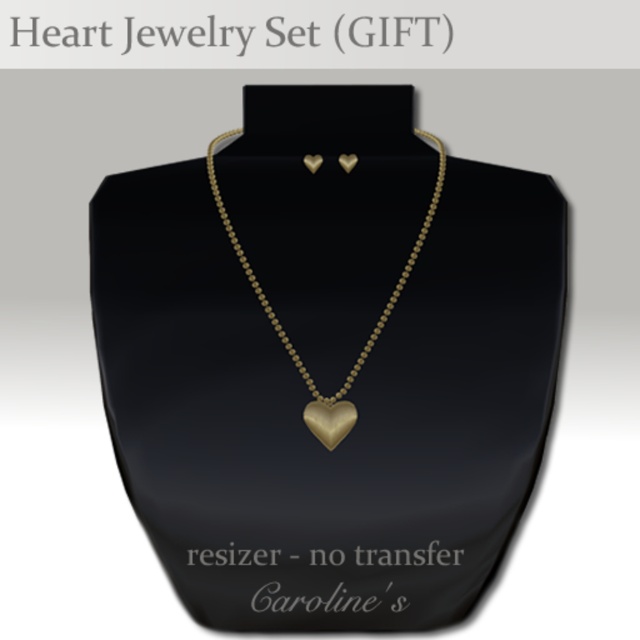
Question: Which point is farther to the camera?

Choices:
 (A) (342, 433)
 (B) (416, 248)

Answer: (B)

Question: From the image, what is the correct spatial relationship of gold matte heart-shaped pendant at center in relation to gold matte heart at center?

Choices:
 (A) right
 (B) left

Answer: (B)

Question: Can you confirm if gold matte heart-shaped pendant at center is thinner than gold matte heart at center?

Choices:
 (A) no
 (B) yes

Answer: (A)

Question: From the image, what is the correct spatial relationship of gold matte heart-shaped pendant at center in relation to gold matte heart at center?

Choices:
 (A) below
 (B) above

Answer: (B)

Question: Which point is closer to the camera?

Choices:
 (A) gold matte heart-shaped pendant at center
 (B) gold matte heart at center

Answer: (A)